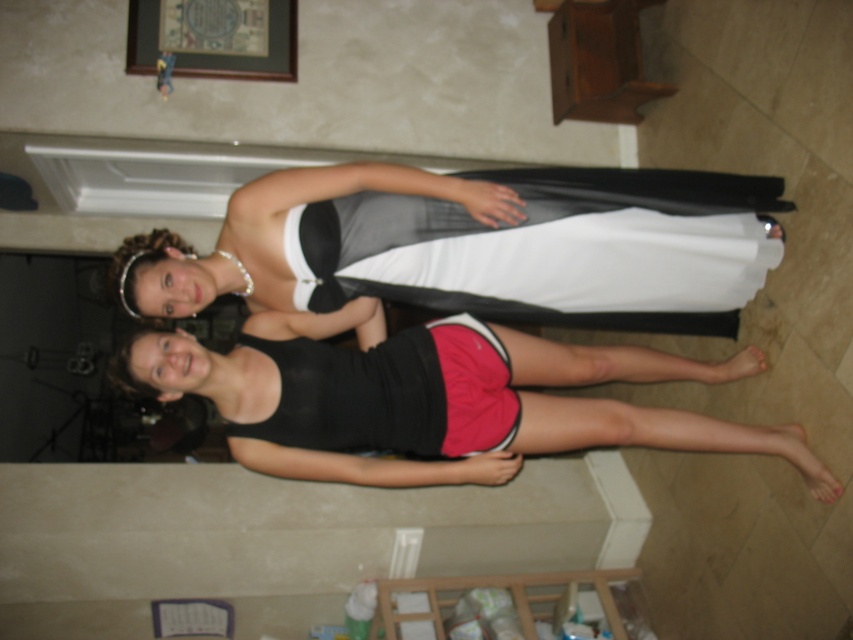
Question: Which object appears closest to the camera in this image?

Choices:
 (A) black matte shorts at lower center
 (B) matte black dress at center

Answer: (B)

Question: Is matte black dress at center positioned behind black matte shorts at lower center?

Choices:
 (A) no
 (B) yes

Answer: (A)

Question: Which object is closer to the camera taking this photo?

Choices:
 (A) matte black dress at center
 (B) black matte shorts at lower center

Answer: (A)

Question: Is matte black dress at center above black matte shorts at lower center?

Choices:
 (A) no
 (B) yes

Answer: (B)

Question: Does matte black dress at center have a smaller size compared to black matte shorts at lower center?

Choices:
 (A) no
 (B) yes

Answer: (B)